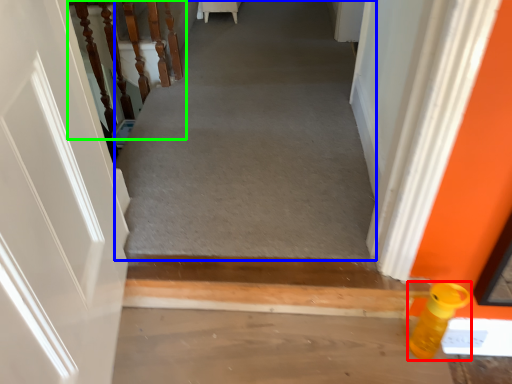
Question: Which object is positioned farthest from bottle (highlighted by a red box)? Select from passage (highlighted by a blue box) and stairwell (highlighted by a green box).

Choices:
 (A) passage
 (B) stairwell

Answer: (B)